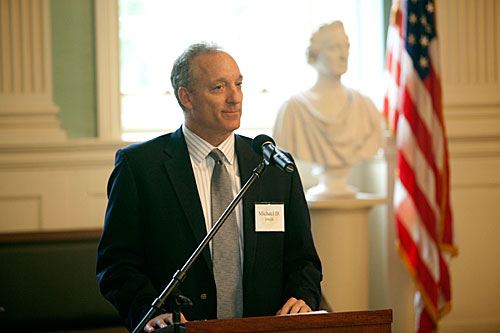
At what (x,y) coordinates should I click in order to perform the action: click on coat. Please return your answer as a coordinate pair (x, y). The width and height of the screenshot is (500, 333). Looking at the image, I should click on (161, 174).